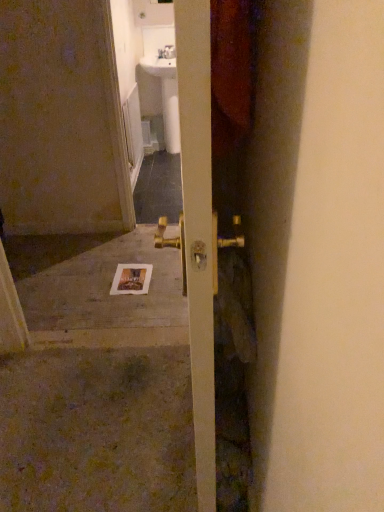
Identify the location of vacant space in front of white paper postcard at center. (132, 305).